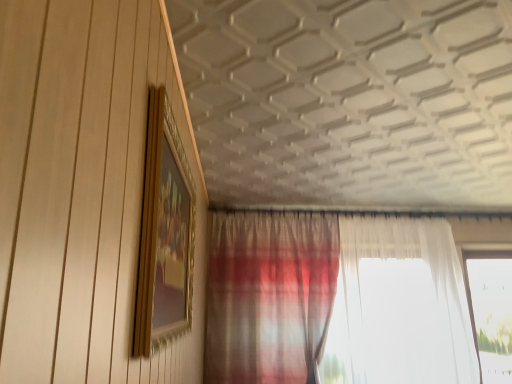
Question: In terms of width, does transparent glass window at right look wider or thinner when compared to gold/gilded picture frame at upper left?

Choices:
 (A) wide
 (B) thin

Answer: (A)

Question: Is transparent glass window at right taller or shorter than gold/gilded picture frame at upper left?

Choices:
 (A) short
 (B) tall

Answer: (B)

Question: Estimate the real-world distances between objects in this image. Which object is closer to the plaid fabric curtain at lower center?

Choices:
 (A) transparent glass window at right
 (B) gold/gilded picture frame at upper left

Answer: (A)

Question: Estimate the real-world distances between objects in this image. Which object is farther from the gold/gilded picture frame at upper left?

Choices:
 (A) transparent glass window at right
 (B) plaid fabric curtain at lower center

Answer: (A)